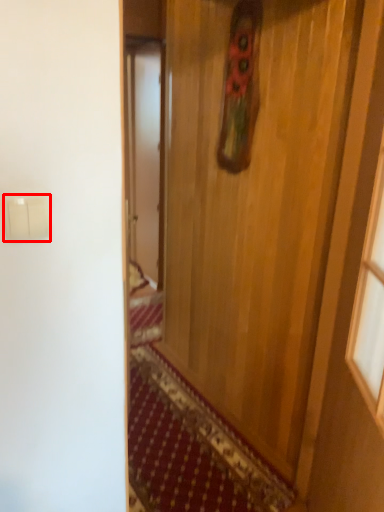
Question: From the image, what is the correct spatial relationship of light switch (annotated by the red box) in relation to door?

Choices:
 (A) right
 (B) left

Answer: (B)